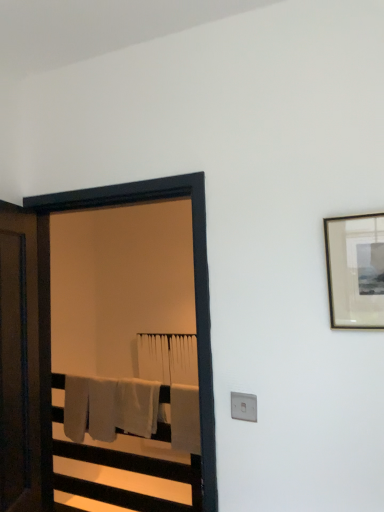
Question: Do you think white cotton bath towel at center, arranged as the first bath towel when viewed from the back, is within black wooden screen door at left, or outside of it?

Choices:
 (A) inside
 (B) outside

Answer: (B)

Question: Considering their positions, is white cotton bath towel at center, arranged as the first bath towel when viewed from the back, located in front of or behind black wooden screen door at left?

Choices:
 (A) behind
 (B) front

Answer: (A)

Question: Estimate the real-world distances between objects in this image. Which object is closer to the black wooden screen door at left?

Choices:
 (A) matte black picture frame at upper right
 (B) white soft bath towel at center, which ranks as the second bath towel in front-to-back order
 (C) white plastic electric outlet at lower center
 (D) white cotton bath towel at center, which ranks as the first bath towel in front-to-back order
 (E) brown wooden door at left

Answer: (C)

Question: Estimate the real-world distances between objects in this image. Which object is closer to the black wooden screen door at left?

Choices:
 (A) white plastic electric outlet at lower center
 (B) matte black picture frame at upper right
 (C) white soft bath towel at center, marked as the second bath towel in a back-to-front arrangement
 (D) brown wooden door at left
 (E) white cotton bath towel at center, marked as the third bath towel in a front-to-back arrangement

Answer: (A)